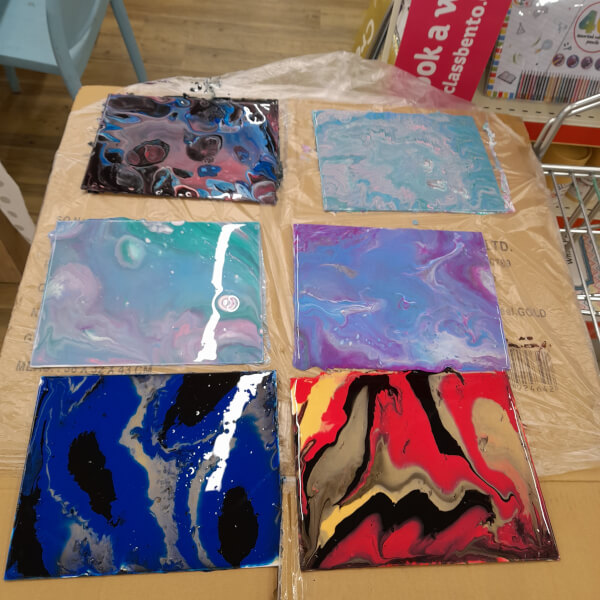
This screenshot has width=600, height=600. I want to click on red paint, so click(x=416, y=463).